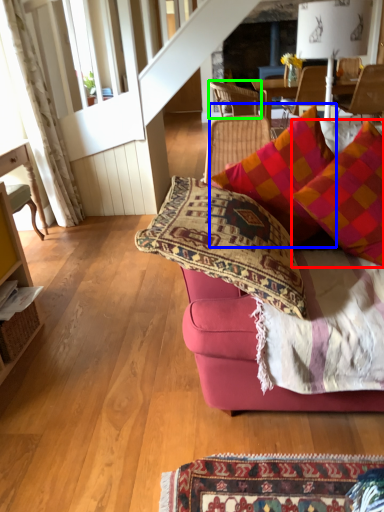
Question: Which is farther away from pillow (highlighted by a red box)? pillow (highlighted by a blue box) or chair (highlighted by a green box)?

Choices:
 (A) pillow
 (B) chair

Answer: (B)